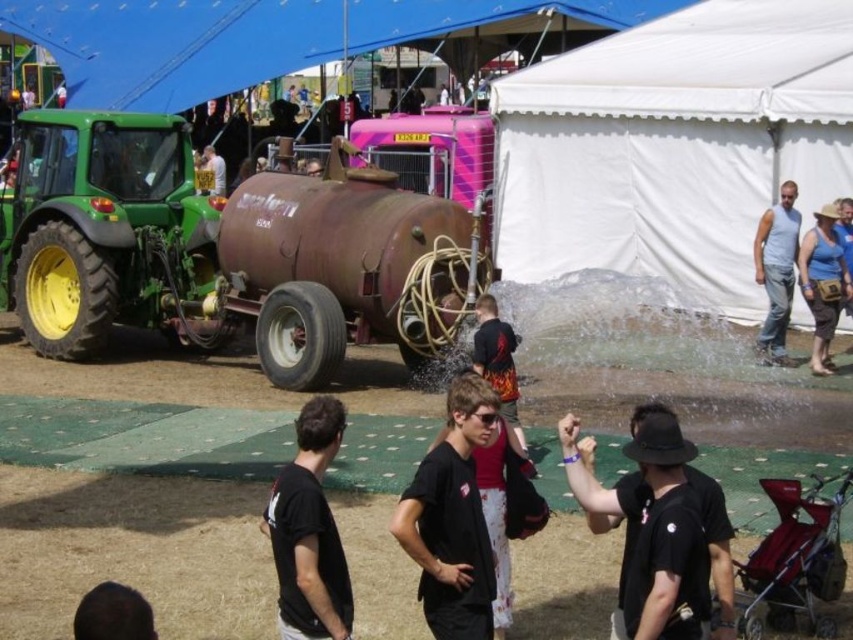
Between point (701, 88) and point (778, 316), which one is positioned in front?

Point (778, 316) is in front.

Is point (798, 83) less distant than point (769, 266)?

No, (798, 83) is behind (769, 266).

This screenshot has height=640, width=853. What are the coordinates of `white fabric tent at center` in the screenshot? It's located at click(674, 145).

Is green matte tractor at left to the right of white fabric tent at center from the viewer's perspective?

No, green matte tractor at left is not to the right of white fabric tent at center.

Can you confirm if green matte tractor at left is shorter than white fabric tent at center?

No.

What do you see at coordinates (221, 250) in the screenshot?
I see `green matte tractor at left` at bounding box center [221, 250].

This screenshot has width=853, height=640. In order to click on green matte tractor at left in this screenshot , I will do `click(221, 250)`.

From the picture: Who is more distant from viewer, (849, 12) or (457, 620)?

The point (849, 12) is more distant.

Does white fabric tent at center have a greater width compared to black matte shirt at center?

No, white fabric tent at center is not wider than black matte shirt at center.

Does point (825, 163) come farther from viewer compared to point (466, 556)?

Yes, point (825, 163) is behind point (466, 556).

At what (x,y) coordinates should I click in order to perform the action: click on white fabric tent at center. Please return your answer as a coordinate pair (x, y). Image resolution: width=853 pixels, height=640 pixels. Looking at the image, I should click on (674, 145).